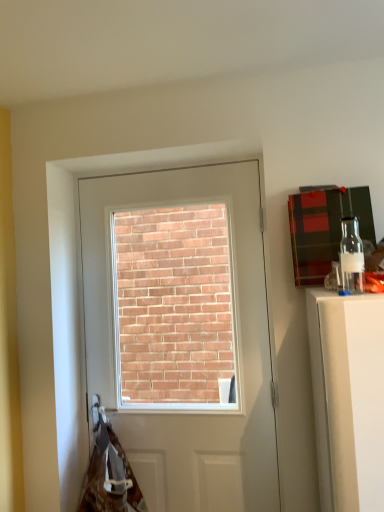
Question: From the image's perspective, is brown fabric at lower left above or below white glossy door at center?

Choices:
 (A) above
 (B) below

Answer: (B)

Question: In the image, is brown fabric at lower left positioned in front of or behind white glossy door at center?

Choices:
 (A) behind
 (B) front

Answer: (B)

Question: Which object is the farthest from the white glossy door at center?

Choices:
 (A) clear glass bottle at upper right
 (B) brown fabric at lower left

Answer: (A)

Question: Estimate the real-world distances between objects in this image. Which object is farther from the brown fabric at lower left?

Choices:
 (A) white glossy door at center
 (B) clear glass bottle at upper right

Answer: (B)